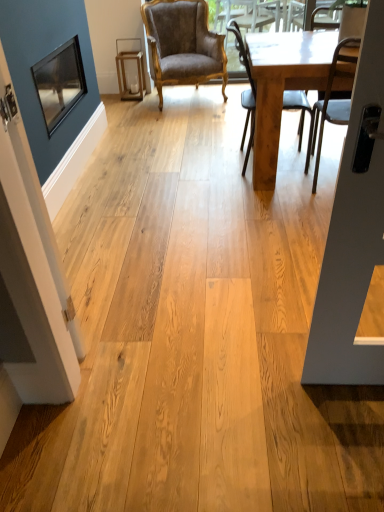
The image size is (384, 512). I want to click on vacant space positioned to the left of metallic silver chair at right, the 3th chair from the left, so click(x=268, y=199).